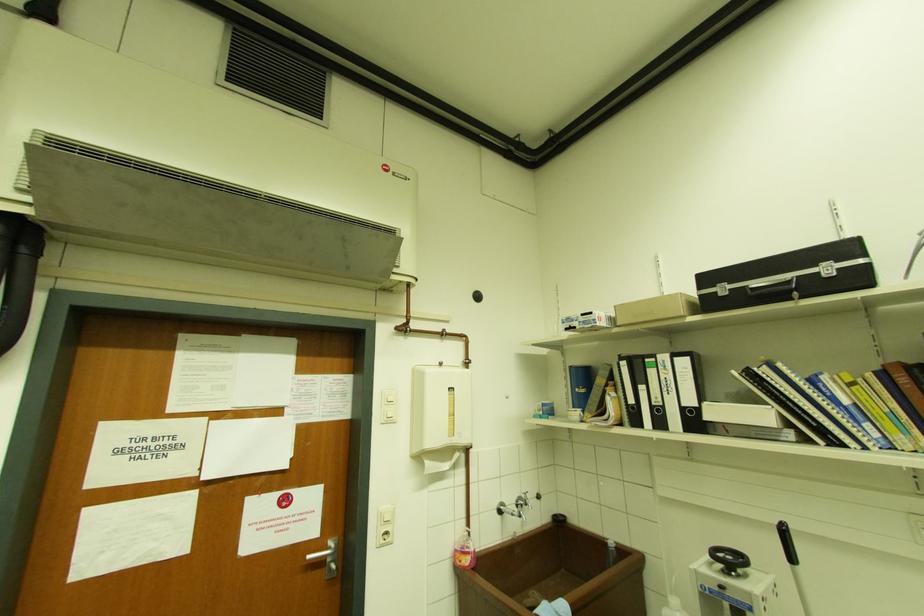
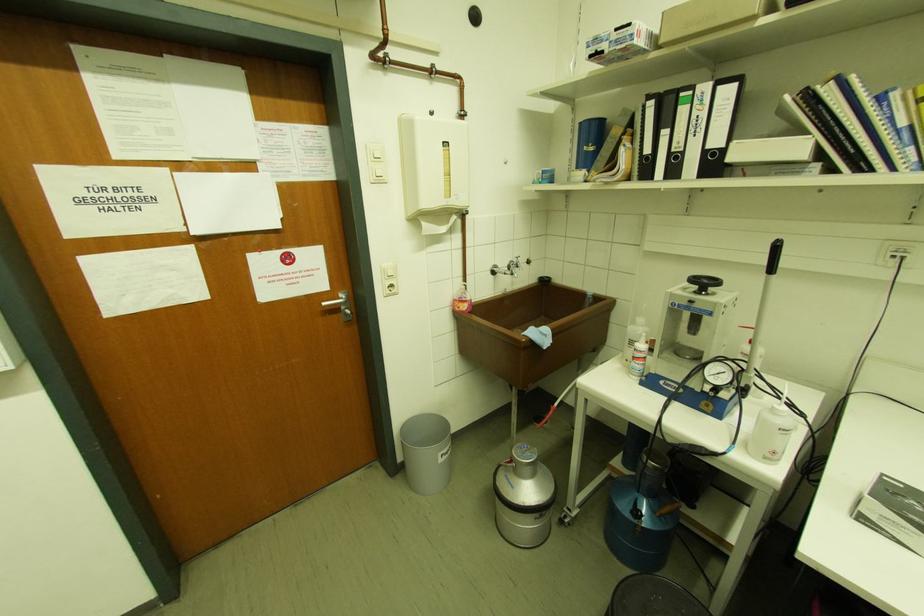
Where in the second image is the point corresponding to (393,422) from the first image?

(383, 182)